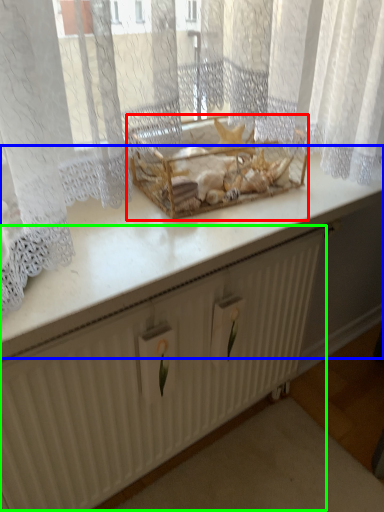
Question: Which object is positioned farthest from crate (highlighted by a red box)? Select from counter top (highlighted by a blue box) and radiator (highlighted by a green box).

Choices:
 (A) counter top
 (B) radiator

Answer: (B)